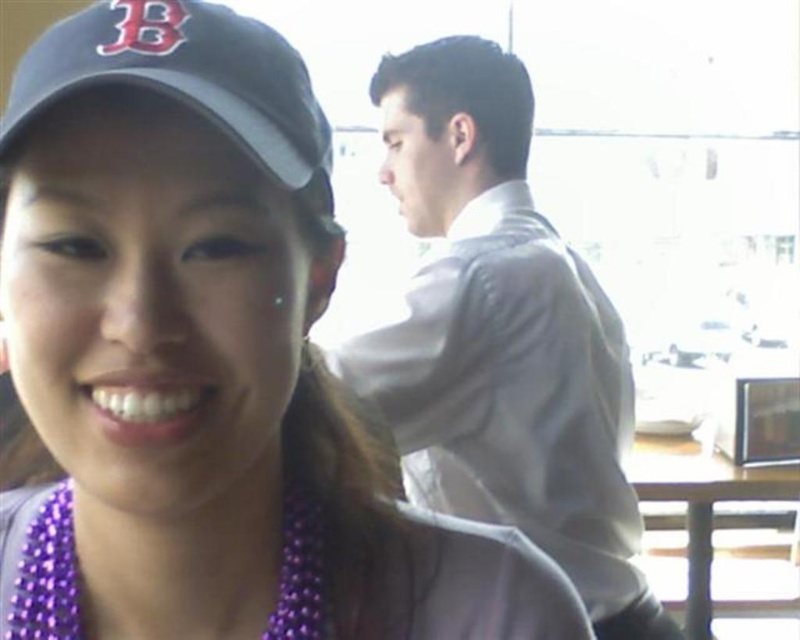
Can you confirm if purple beaded necklace at center is positioned above purple beaded necklace at lower left?

Yes.

Who is more distant from viewer, (408, 577) or (318, 536)?

The point (408, 577) is behind.

The width and height of the screenshot is (800, 640). I want to click on purple beaded necklace at center, so click(x=206, y=362).

At what (x,y) coordinates should I click in order to perform the action: click on white smooth shirt at upper center. Please return your answer as a coordinate pair (x, y). Looking at the image, I should click on (501, 336).

Consider the image. Is white smooth shirt at upper center shorter than black fabric baseball cap at upper left?

No, white smooth shirt at upper center is not shorter than black fabric baseball cap at upper left.

At what (x,y) coordinates should I click in order to perform the action: click on white smooth shirt at upper center. Please return your answer as a coordinate pair (x, y). Looking at the image, I should click on (501, 336).

The width and height of the screenshot is (800, 640). What do you see at coordinates (501, 336) in the screenshot? I see `white smooth shirt at upper center` at bounding box center [501, 336].

Is point (472, 141) farther from camera compared to point (318, 548)?

Yes.

This screenshot has height=640, width=800. I want to click on white smooth shirt at upper center, so click(x=501, y=336).